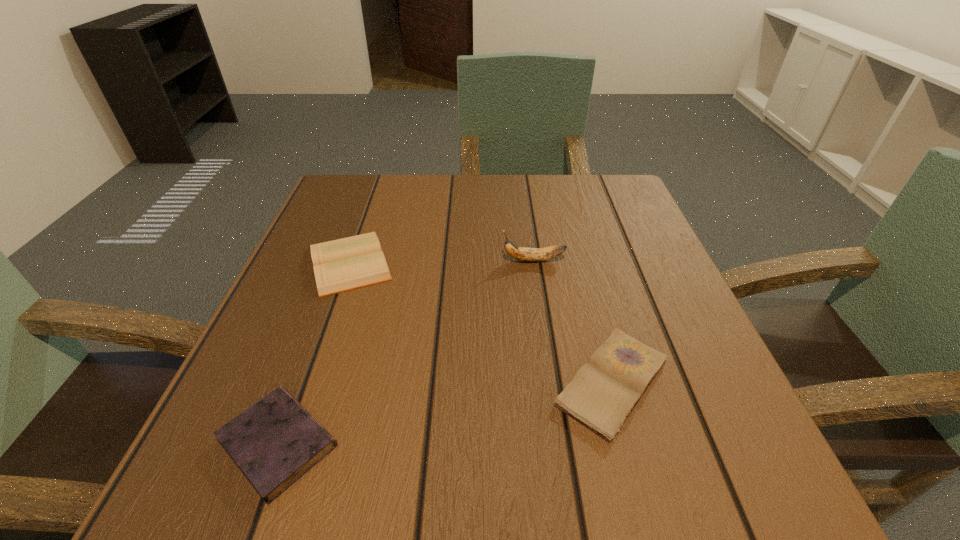
I want to click on vacant area between the banana and the rightmost diary, so click(573, 321).

This screenshot has width=960, height=540. I want to click on vacant space in between the farthest diary and the rightmost diary, so [x=481, y=322].

The image size is (960, 540). Identify the location of vacant space in between the farthest diary and the tallest object. (442, 261).

Find the location of a particular element. The image size is (960, 540). free area in between the rightmost diary and the banana is located at coordinates (573, 321).

Identify the location of the closest object to the banana. (604, 391).

Select which object is the second closest to the farthest diary. Please provide its 2D coordinates. Your answer should be formatted as a tuple, i.e. [(x, y)], where the tuple contains the x and y coordinates of a point satisfying the conditions above.

[(520, 253)]

Choose which diary is the third nearest neighbor to the banana. Please provide its 2D coordinates. Your answer should be formatted as a tuple, i.e. [(x, y)], where the tuple contains the x and y coordinates of a point satisfying the conditions above.

[(274, 442)]

Locate an element on the screen. diary identified as the closest to the rightmost diary is located at coordinates (341, 265).

At what (x,y) coordinates should I click in order to perform the action: click on vacant region that satisfies the following two spatial constraints: 1. on the back side of the rightmost diary; 2. on the peel of the banana. Please return your answer as a coordinate pair (x, y). This screenshot has height=540, width=960. Looking at the image, I should click on (579, 260).

Locate an element on the screen. Image resolution: width=960 pixels, height=540 pixels. free space in the image that satisfies the following two spatial constraints: 1. on the peel of the banana; 2. on the left side of the rightmost diary is located at coordinates (551, 383).